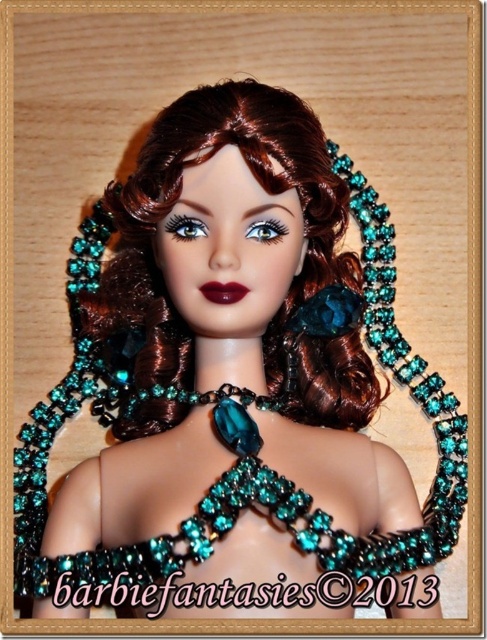
Question: Can you confirm if shiny brown hair at center is positioned below teal beaded necklace at center?

Choices:
 (A) yes
 (B) no

Answer: (B)

Question: Does shiny brown hair at center come behind teal beaded necklace at center?

Choices:
 (A) yes
 (B) no

Answer: (A)

Question: Which of the following is the farthest from the observer?

Choices:
 (A) (56, 417)
 (B) (137, 300)

Answer: (A)

Question: Which point appears closest to the camera in this image?

Choices:
 (A) (241, 493)
 (B) (150, 339)

Answer: (A)

Question: Is shiny brown hair at center closer to the viewer compared to teal beaded necklace at center?

Choices:
 (A) yes
 (B) no

Answer: (B)

Question: Among these points, which one is nearest to the camera?

Choices:
 (A) (313, 388)
 (B) (74, 588)

Answer: (B)